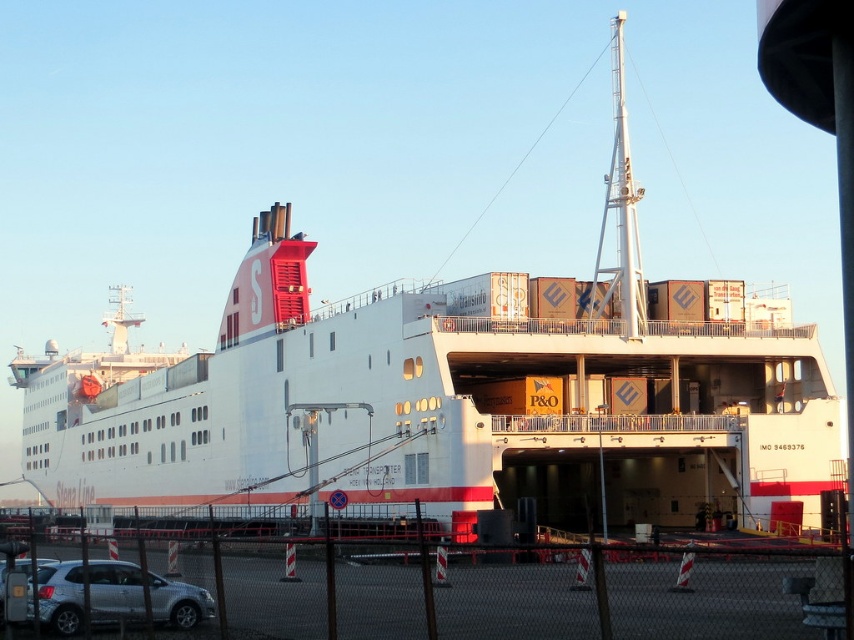
Who is shorter, metal mesh fence at lower center or silver metallic car at lower left?

Standing shorter between the two is silver metallic car at lower left.

Is metal mesh fence at lower center to the left of silver metallic car at lower left from the viewer's perspective?

No, metal mesh fence at lower center is not to the left of silver metallic car at lower left.

Is point (71, 589) less distant than point (16, 566)?

Yes, point (71, 589) is in front of point (16, 566).

Find the location of a particular element. metal mesh fence at lower center is located at coordinates (428, 586).

Is silver metallic suv at lower left to the right of silver metallic car at lower left from the viewer's perspective?

Correct, you'll find silver metallic suv at lower left to the right of silver metallic car at lower left.

Locate an element on the screen. This screenshot has height=640, width=854. silver metallic suv at lower left is located at coordinates (115, 592).

Is metal mesh fence at lower center smaller than silver metallic suv at lower left?

No, metal mesh fence at lower center is not smaller than silver metallic suv at lower left.

Describe the element at coordinates (428, 586) in the screenshot. I see `metal mesh fence at lower center` at that location.

The height and width of the screenshot is (640, 854). In order to click on metal mesh fence at lower center in this screenshot , I will do `click(428, 586)`.